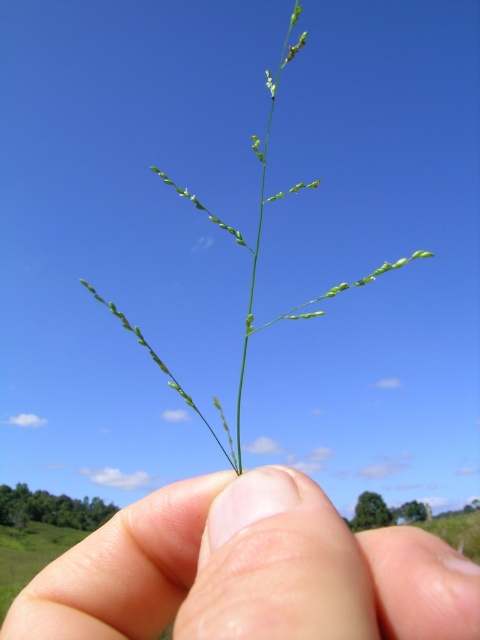
Question: Which object appears farthest from the camera in this image?

Choices:
 (A) smooth skin at center
 (B) green leafy plant at center

Answer: (B)

Question: Which of the following is the closest to the observer?

Choices:
 (A) smooth skin at center
 (B) green leafy plant at center

Answer: (A)

Question: Observing the image, what is the correct spatial positioning of smooth skin at center in reference to green leafy plant at center?

Choices:
 (A) above
 (B) below

Answer: (B)

Question: Considering the relative positions of smooth skin at center and green leafy plant at center in the image provided, where is smooth skin at center located with respect to green leafy plant at center?

Choices:
 (A) below
 (B) above

Answer: (A)

Question: Is smooth skin at center closer to camera compared to green leafy plant at center?

Choices:
 (A) yes
 (B) no

Answer: (A)